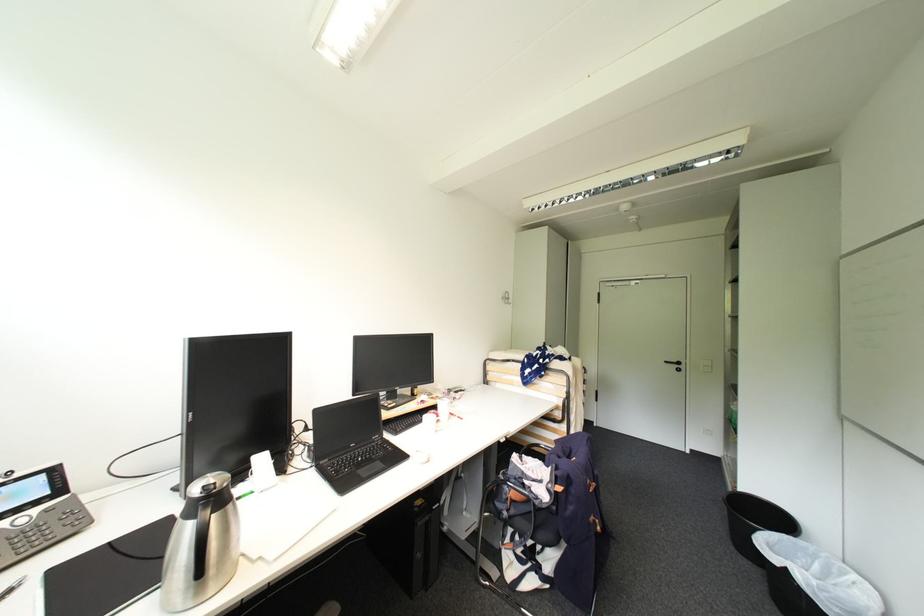
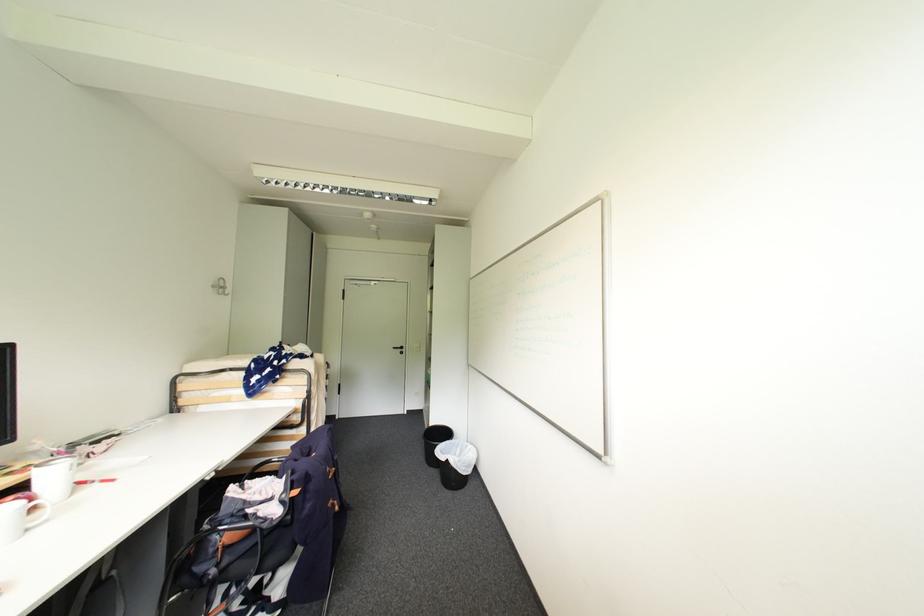
Locate, in the second image, the point that corresponds to pixel 795 538 in the first image.

(456, 442)